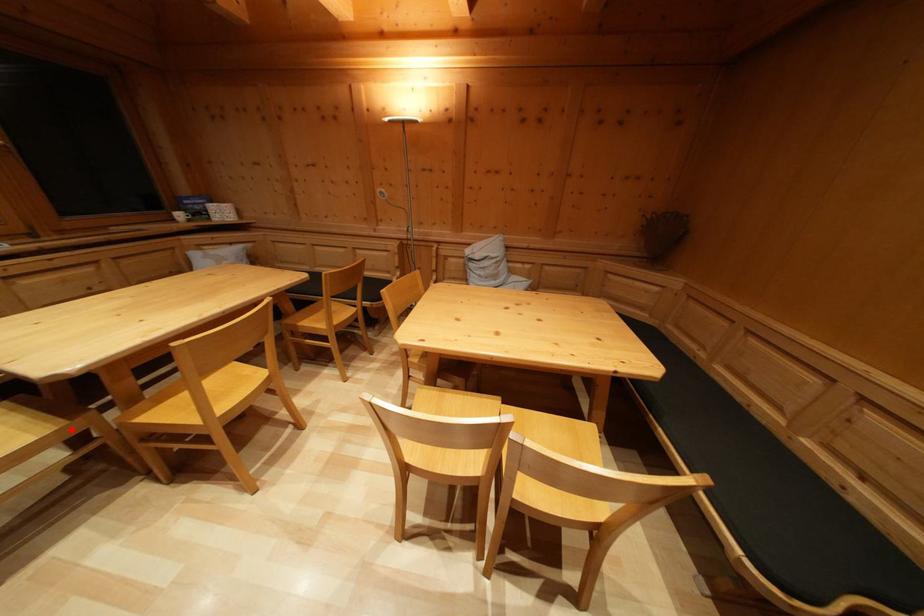
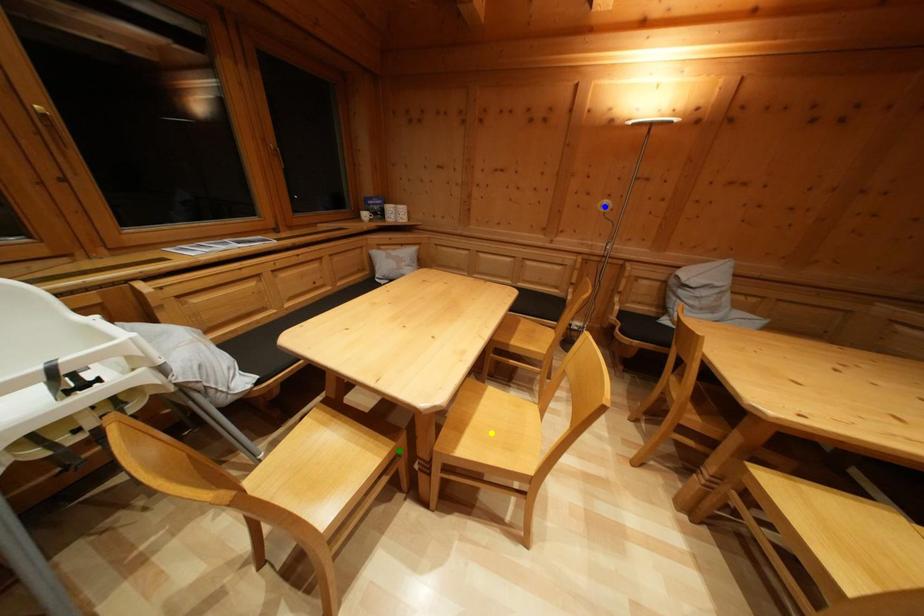
Question: I am providing you with two images of the same scene from different viewpoints. A red point is marked on the first image. You are given multiple points on the second image. Which mark in image 2 goes with the point in image 1?

Choices:
 (A) blue point
 (B) green point
 (C) yellow point

Answer: (B)